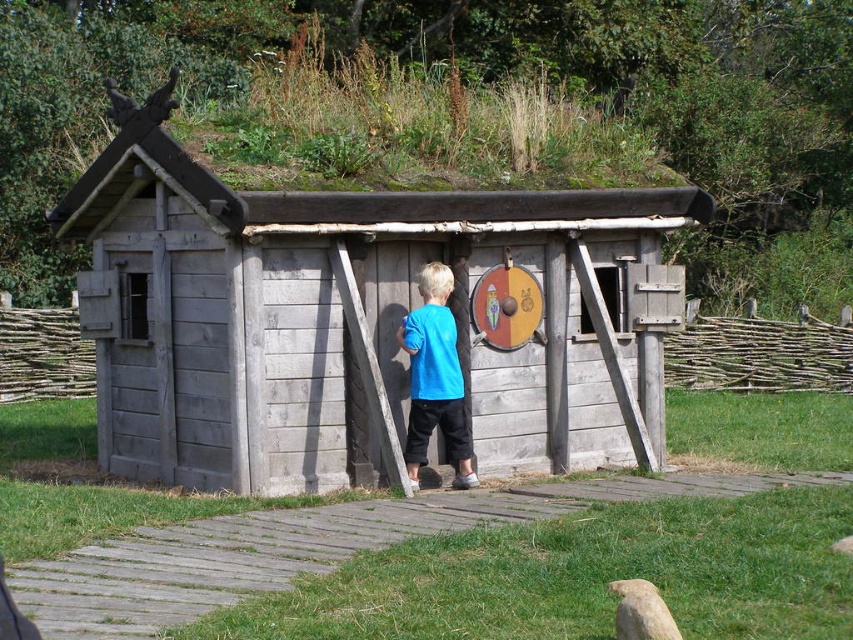
You are a parent trying to decide whether to let your child play near the weathered wood hut at center and the blue cotton shirt at center. Considering their sizes, which object is bigger and safer for the child to play around?

The weathered wood hut at center is larger in size compared to the blue cotton shirt at center, so it is safer for the child to play around the weathered wood hut at center as it provides more space and stability.

You are standing at the point marked as point (345, 317) in the image. What structure are you facing directly in front of you?

You are facing the weathered wood hut at center directly in front of you at point (345, 317).